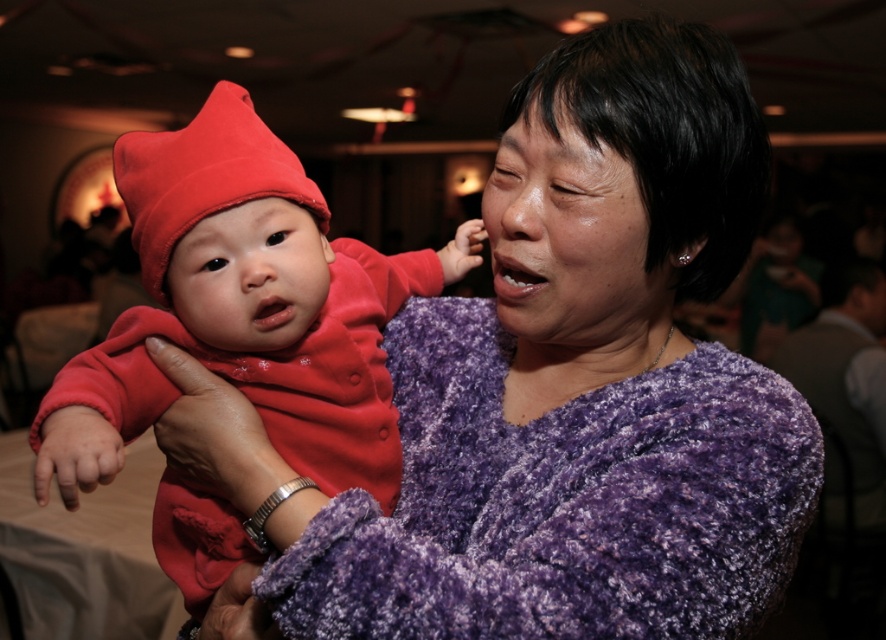
You are standing in the room where the adult and baby are. You want to place a small decoration between the two points, point (659, 49) and point (188, 193). Which point should the decoration be closer to in order to appear closer to you?

The decoration should be placed closer to point (659, 49) because it is closer to the viewer than point (188, 193).

Looking at this image, you are a photographer at the event and want to capture a clear shot of both the velvety red baby at center and the matte red beanie at center. Since the beanie is part of the baby outfit, will the beanie be visible in the photo if you focus on the baby?

The velvety red baby at center is in front of the matte red beanie at center, so if you focus on the baby, the beanie might be partially or fully obscured depending on the focus and depth of field. However, since the beanie is part of the baby outfit and positioned at the same center point, it should still be visible in the photo.